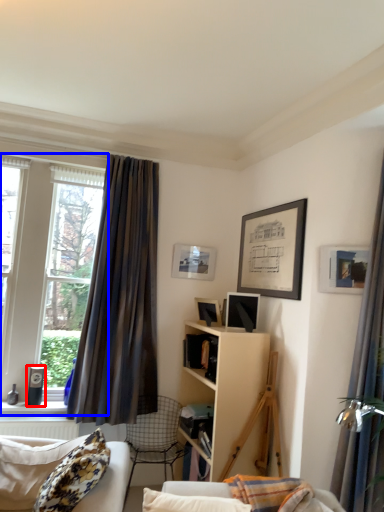
Question: Among these objects, which one is nearest to the camera, speaker (highlighted by a red box) or window (highlighted by a blue box)?

Choices:
 (A) speaker
 (B) window

Answer: (B)